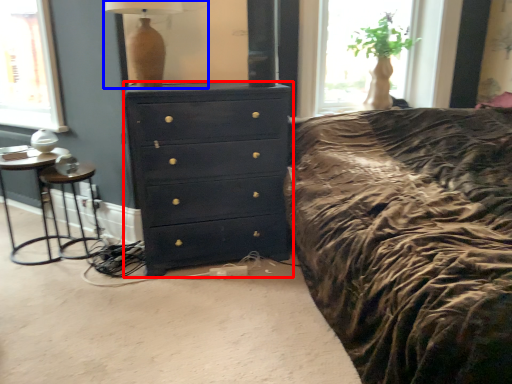
Question: Among these objects, which one is nearest to the camera, chest of drawers (highlighted by a red box) or table lamp (highlighted by a blue box)?

Choices:
 (A) chest of drawers
 (B) table lamp

Answer: (B)